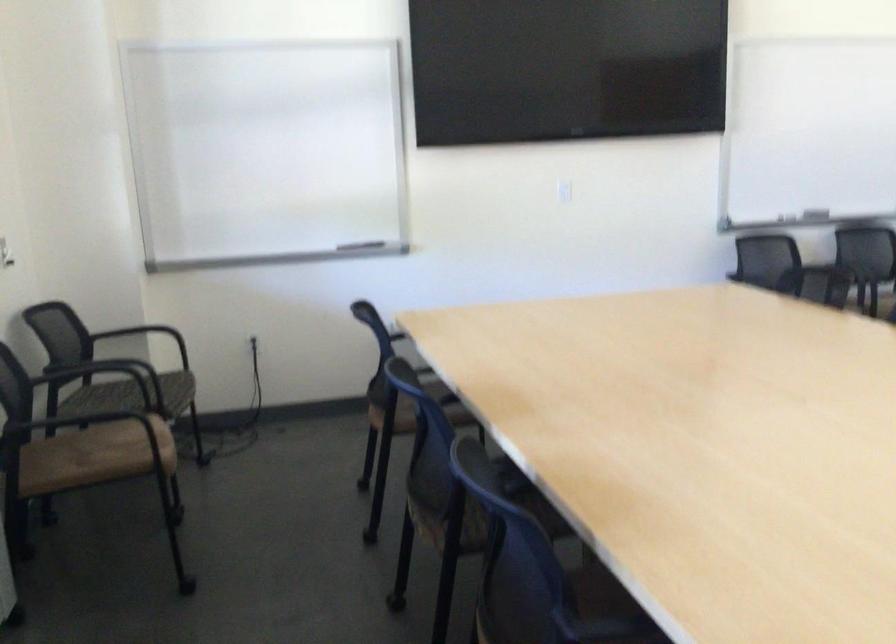
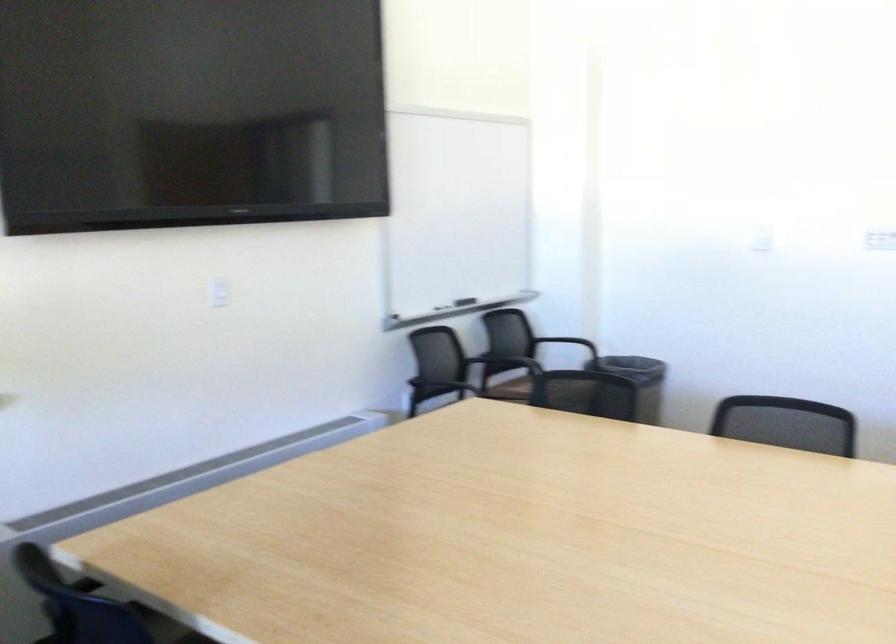
Where in the second image is the point corresponding to (794,252) from the first image?

(437, 355)